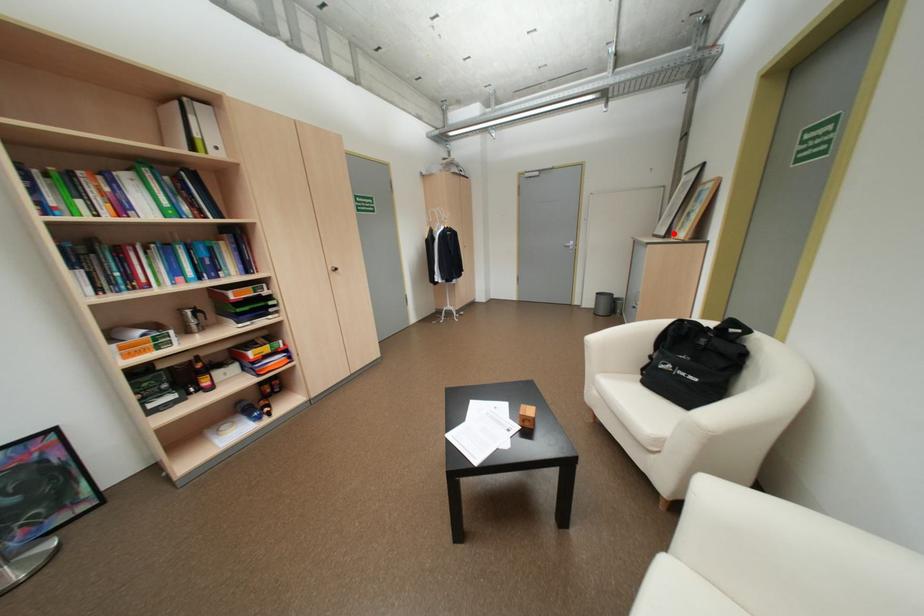
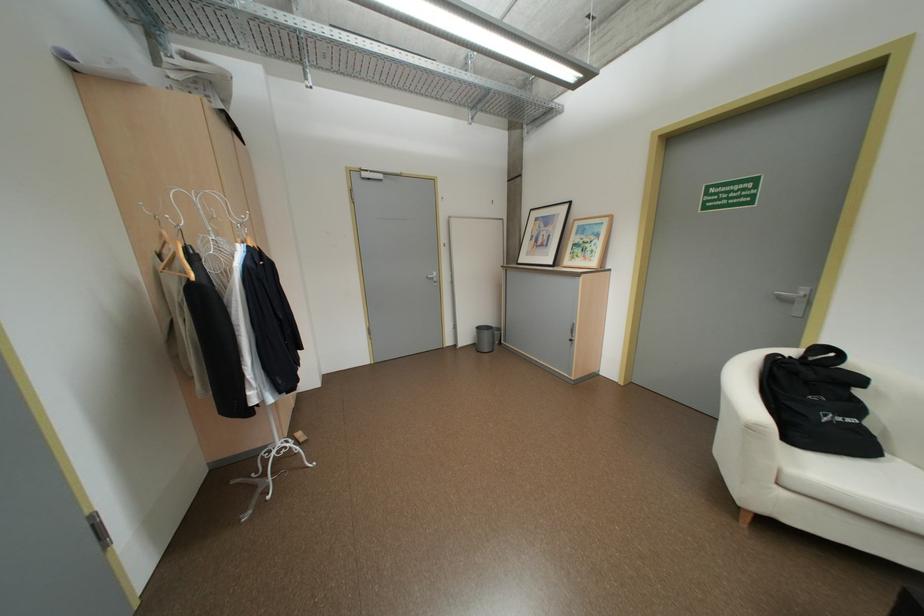
Locate, in the second image, the point that corresponds to the highlighted location in the first image.

(561, 262)